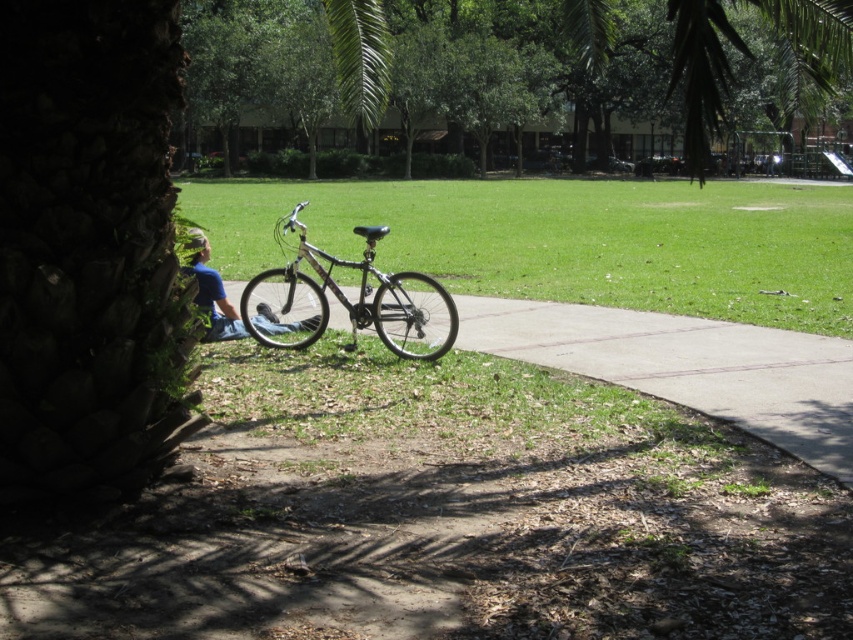
Does point (785, 324) lie in front of point (308, 336)?

No, it is behind (308, 336).

Is green grass at center shorter than silver metallic bicycle at center?

No.

Is point (595, 211) positioned after point (248, 308)?

Yes, point (595, 211) is farther from viewer.

The image size is (853, 640). I want to click on green grass at center, so click(567, 241).

You are a GUI agent. You are given a task and a screenshot of the screen. Output one action in this format:
    pyautogui.click(x=<x>, y=<y>)
    Task: Click on the green leafy tree at upper center
    
    Given the screenshot: What is the action you would take?
    pyautogui.click(x=701, y=72)

I want to click on green leafy tree at upper center, so click(701, 72).

Where is `green leafy tree at upper center`? The width and height of the screenshot is (853, 640). green leafy tree at upper center is located at coordinates (701, 72).

Based on the photo, does green grass at center have a lesser width compared to gray concrete pavement at center?

In fact, green grass at center might be wider than gray concrete pavement at center.

Who is more distant from viewer, [582,256] or [810,369]?

Positioned behind is point [582,256].

Image resolution: width=853 pixels, height=640 pixels. In order to click on green grass at center in this screenshot , I will do pyautogui.click(x=567, y=241).

At what (x,y) coordinates should I click in order to perform the action: click on green grass at center. Please return your answer as a coordinate pair (x, y). The width and height of the screenshot is (853, 640). Looking at the image, I should click on (567, 241).